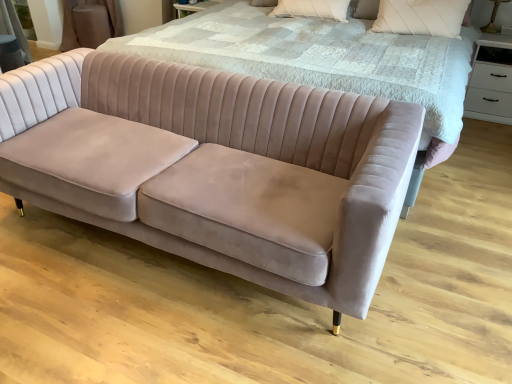
The width and height of the screenshot is (512, 384). I want to click on vacant area that is in front of matte gold table lamp at upper right, so click(493, 35).